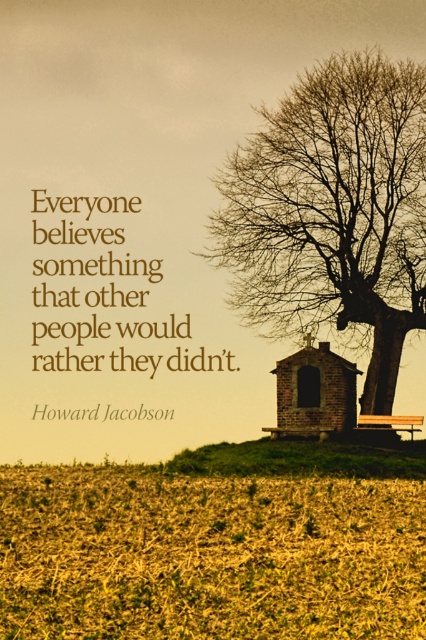
You are standing at the base of the large leafless tree to the right of the brick chapel at center. You want to read the brown paper text at upper center but can only see objects within 25 feet. Can you see the text?

The brown paper text at upper center is 26.44 feet away from the brick chapel at center. Since you are at the base of the tree to the right of the chapel, your distance to the text would be more than 25 feet, so you cannot see it.

You are standing at the camera position and want to read the brown paper text at upper center. Can you read it clearly from where you are?

The brown paper text at upper center is 27.60 meters away from the camera, so it might be difficult to read clearly from that distance.

You are a visitor at the chapel and want to read the brown paper text at upper center. You are currently standing next to the wooden park bench at lower right. Can you see the text clearly from there?

The brown paper text at upper center is bigger than wooden park bench at lower right, so yes, you can see the text clearly from the wooden park bench at lower right since it is larger in size and positioned higher up.